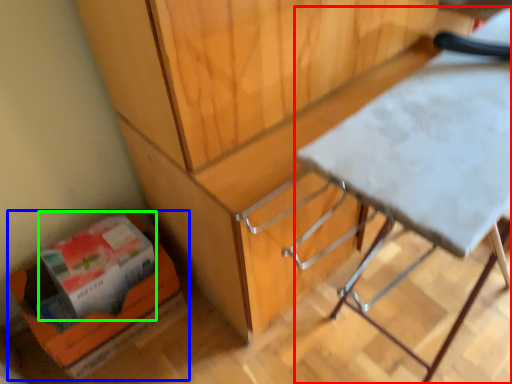
Question: Which is farther away from table (highlighted by a red box)? cardboard box (highlighted by a blue box) or box (highlighted by a green box)?

Choices:
 (A) cardboard box
 (B) box

Answer: (B)